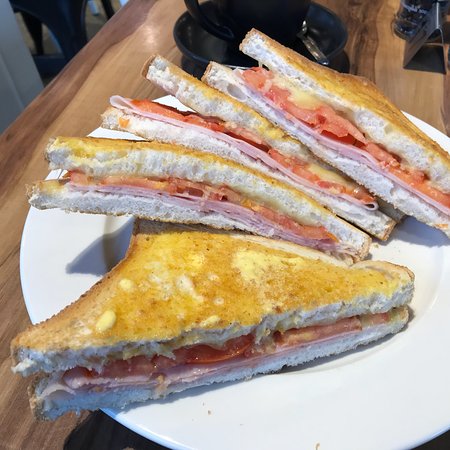
Locate an element on the screen. Image resolution: width=450 pixels, height=450 pixels. white trim behind table is located at coordinates (17, 45).